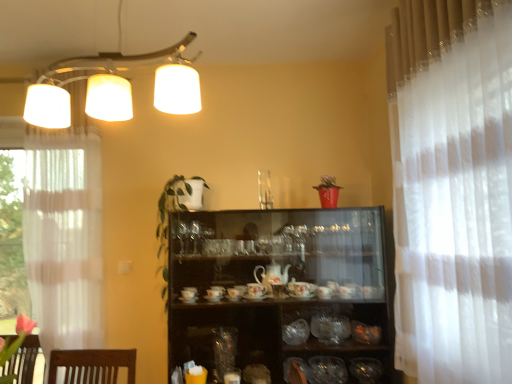
Describe the element at coordinates (330, 328) in the screenshot. This screenshot has height=384, width=512. I see `translucent glass bowls at center, the third tableware from the right` at that location.

What do you see at coordinates (114, 87) in the screenshot? I see `metallic chrome lamp at upper left` at bounding box center [114, 87].

Describe the element at coordinates (452, 188) in the screenshot. I see `white sheer curtain at right` at that location.

This screenshot has width=512, height=384. In order to click on white sheer curtain at right in this screenshot , I will do `click(452, 188)`.

This screenshot has height=384, width=512. What do you see at coordinates (168, 222) in the screenshot? I see `green leafy plant at center` at bounding box center [168, 222].

Find the location of a particular element. The image size is (512, 384). translucent glass bowls at center, the third tableware from the right is located at coordinates (330, 328).

Considering the relative sizes of metallic chrome lamp at upper left and transparent glass bowl at center, arranged as the 2th tableware when viewed from the left, in the image provided, is metallic chrome lamp at upper left bigger than transparent glass bowl at center, arranged as the 2th tableware when viewed from the left,?

Yes.

Is metallic chrome lamp at upper left not inside transparent glass bowl at center, the fourth tableware positioned from the right?

That's correct, metallic chrome lamp at upper left is outside of transparent glass bowl at center, the fourth tableware positioned from the right.

Is metallic chrome lamp at upper left oriented away from transparent glass bowl at center, the fourth tableware positioned from the right?

No, metallic chrome lamp at upper left is not facing away from transparent glass bowl at center, the fourth tableware positioned from the right.

Is metallic chrome lamp at upper left far away from transparent glass bowl at center, the fourth tableware positioned from the right?

Yes.

From the image's perspective, who appears lower, white sheer curtain at right or transparent glass bowl at center, arranged as the 2th tableware when viewed from the left?

From the image's view, transparent glass bowl at center, arranged as the 2th tableware when viewed from the left, is below.

Considering the points (430, 54) and (320, 358), which point is in front, point (430, 54) or point (320, 358)?

The point (430, 54) is closer.

Is white sheer curtain at right directly adjacent to transparent glass bowl at center, arranged as the 2th tableware when viewed from the left?

No, white sheer curtain at right is not making contact with transparent glass bowl at center, arranged as the 2th tableware when viewed from the left.

Does translucent glass bowls at center, which is the third tableware from left to right, have a lesser width compared to metallic chrome lamp at upper left?

Yes, translucent glass bowls at center, which is the third tableware from left to right, is thinner than metallic chrome lamp at upper left.

Does point (317, 316) appear closer or farther from the camera than point (92, 67)?

Point (317, 316) is closer to the camera than point (92, 67).

Is the surface of translucent glass bowls at center, which is the third tableware from left to right, in direct contact with metallic chrome lamp at upper left?

No, translucent glass bowls at center, which is the third tableware from left to right, is not beside metallic chrome lamp at upper left.

Is translucent glass bowls at center, which is the third tableware from left to right, looking in the opposite direction of metallic chrome lamp at upper left?

That's not correct — translucent glass bowls at center, which is the third tableware from left to right, is not looking away from metallic chrome lamp at upper left.

Are shiny metallic bowl at lower right, which ranks as the fourth tableware in left-to-right order, and translucent glass bowl at lower right, the 5th tableware from the left, far apart?

No.

Is translucent glass bowl at lower right, the 5th tableware from the left, completely or partially inside shiny metallic bowl at lower right, which ranks as the 2th tableware in right-to-left order?

No, translucent glass bowl at lower right, the 5th tableware from the left, is not a part of shiny metallic bowl at lower right, which ranks as the 2th tableware in right-to-left order.

From a real-world perspective, is shiny metallic bowl at lower right, which ranks as the 2th tableware in right-to-left order, under translucent glass bowl at lower right, the 5th tableware from the left?

Yes, from a real-world perspective, shiny metallic bowl at lower right, which ranks as the 2th tableware in right-to-left order, is beneath translucent glass bowl at lower right, the 5th tableware from the left.

Is shiny metallic bowl at lower right, which ranks as the 2th tableware in right-to-left order, oriented away from translucent glass bowl at lower right, marked as the first tableware in a right-to-left arrangement?

No, shiny metallic bowl at lower right, which ranks as the 2th tableware in right-to-left order, is not facing the opposite direction of translucent glass bowl at lower right, marked as the first tableware in a right-to-left arrangement.

Is translucent glass bowls at center, the third tableware from the right, positioned far away from white sheer curtain at right?

Absolutely, translucent glass bowls at center, the third tableware from the right, is distant from white sheer curtain at right.

Which object is thinner, translucent glass bowls at center, the third tableware from the right, or white sheer curtain at right?

With smaller width is white sheer curtain at right.

Is translucent glass bowls at center, the third tableware from the right, to the left of white sheer curtain at right from the viewer's perspective?

Yes.

Does point (331, 319) come in front of point (460, 127)?

No, it is not.

Is white sheer curtain at right inside transparent glass bowl at center, arranged as the 2th tableware when viewed from the left?

No, white sheer curtain at right is not surrounded by transparent glass bowl at center, arranged as the 2th tableware when viewed from the left.

Between transparent glass bowl at center, arranged as the 2th tableware when viewed from the left, and white sheer curtain at right, which one has more height?

white sheer curtain at right is taller.

Identify the location of curtain lying on the right of transparent glass bowl at center, arranged as the 2th tableware when viewed from the left. (452, 188).

From a real-world perspective, between transparent glass bowl at center, arranged as the 2th tableware when viewed from the left, and white sheer curtain at right, who is vertically higher?

white sheer curtain at right is physically above.

At what (x,y) coordinates should I click in order to perform the action: click on tableware that is the 2nd object to the right of the green leafy plant at center, starting at the anchor. Please return your answer as a coordinate pair (x, y). The height and width of the screenshot is (384, 512). Looking at the image, I should click on (327, 370).

In the scene shown: Is transparent glass bowl at center, the fourth tableware positioned from the right, directly adjacent to green leafy plant at center?

transparent glass bowl at center, the fourth tableware positioned from the right, is not next to green leafy plant at center, and they're not touching.

How different are the orientations of transparent glass bowl at center, arranged as the 2th tableware when viewed from the left, and green leafy plant at center in degrees?

There is a 1.74-degree angle between the facing directions of transparent glass bowl at center, arranged as the 2th tableware when viewed from the left, and green leafy plant at center.

Between transparent glass bowl at center, the fourth tableware positioned from the right, and green leafy plant at center, which one has smaller width?

With smaller width is transparent glass bowl at center, the fourth tableware positioned from the right.

The image size is (512, 384). I want to click on lamp in front of the transparent glass bowl at center, the fourth tableware positioned from the right, so click(114, 87).

From the image's perspective, count 5th tablewares downward from the white sheer curtain at right and point to it. Please provide its 2D coordinates.

[(327, 370)]

Considering their positions, is shiny metallic bowl at lower right, which ranks as the fourth tableware in left-to-right order, positioned closer to metallic chrome lamp at upper left than transparent glass bowl at center, arranged as the 2th tableware when viewed from the left?

transparent glass bowl at center, arranged as the 2th tableware when viewed from the left.

From the image, which object appears to be nearer to metallic chrome lamp at upper left, white sheer curtain at right or shiny metallic bowl at lower right, which ranks as the fourth tableware in left-to-right order?

white sheer curtain at right is positioned closer to the anchor metallic chrome lamp at upper left.

When comparing their distances from green leafy plant at center, does transparent glass bowl at center, arranged as the 2th tableware when viewed from the left, or metallic chrome lamp at upper left seem further?

Among the two, transparent glass bowl at center, arranged as the 2th tableware when viewed from the left, is located further to green leafy plant at center.

Considering their positions, is shiny metallic bowl at lower right, which ranks as the 2th tableware in right-to-left order, positioned further to translucent glass bowls at center, which is the third tableware from left to right, than metallic chrome lamp at upper left?

Based on the image, metallic chrome lamp at upper left appears to be further to translucent glass bowls at center, which is the third tableware from left to right.

Looking at the image, which one is located closer to transparent glass vase at center, the fifth tableware in the right-to-left sequence, white sheer curtain at right or shiny metallic bowl at lower right, which ranks as the 2th tableware in right-to-left order?

shiny metallic bowl at lower right, which ranks as the 2th tableware in right-to-left order, lies closer to transparent glass vase at center, the fifth tableware in the right-to-left sequence, than the other object.

Which object lies further to the anchor point green leafy plant at center, translucent glass bowls at center, which is the third tableware from left to right, or shiny metallic bowl at lower right, which ranks as the fourth tableware in left-to-right order?

shiny metallic bowl at lower right, which ranks as the fourth tableware in left-to-right order.

Which object lies nearer to the anchor point translucent glass bowl at lower right, the 5th tableware from the left, transparent glass vase at center, the fifth tableware in the right-to-left sequence, or green leafy plant at center?

Based on the image, transparent glass vase at center, the fifth tableware in the right-to-left sequence, appears to be nearer to translucent glass bowl at lower right, the 5th tableware from the left.

Looking at the image, which one is located further to metallic chrome lamp at upper left, translucent glass bowls at center, which is the third tableware from left to right, or shiny metallic bowl at lower right, which ranks as the fourth tableware in left-to-right order?

shiny metallic bowl at lower right, which ranks as the fourth tableware in left-to-right order, lies further to metallic chrome lamp at upper left than the other object.

At what (x,y) coordinates should I click in order to perform the action: click on plant between metallic chrome lamp at upper left and translucent glass bowls at center, the third tableware from the right, in the up-down direction. Please return your answer as a coordinate pair (x, y). Looking at the image, I should click on (168, 222).

Image resolution: width=512 pixels, height=384 pixels. In order to click on curtain that lies between metallic chrome lamp at upper left and shiny metallic bowl at lower right, which ranks as the 2th tableware in right-to-left order, from top to bottom in this screenshot , I will do `click(452, 188)`.

Locate an element on the screen. This screenshot has height=384, width=512. plant between metallic chrome lamp at upper left and transparent glass vase at center, the fifth tableware in the right-to-left sequence, from front to back is located at coordinates (168, 222).

Where is `tableware between green leafy plant at center and transparent glass bowl at center, the fourth tableware positioned from the right`? This screenshot has width=512, height=384. tableware between green leafy plant at center and transparent glass bowl at center, the fourth tableware positioned from the right is located at coordinates (296, 332).